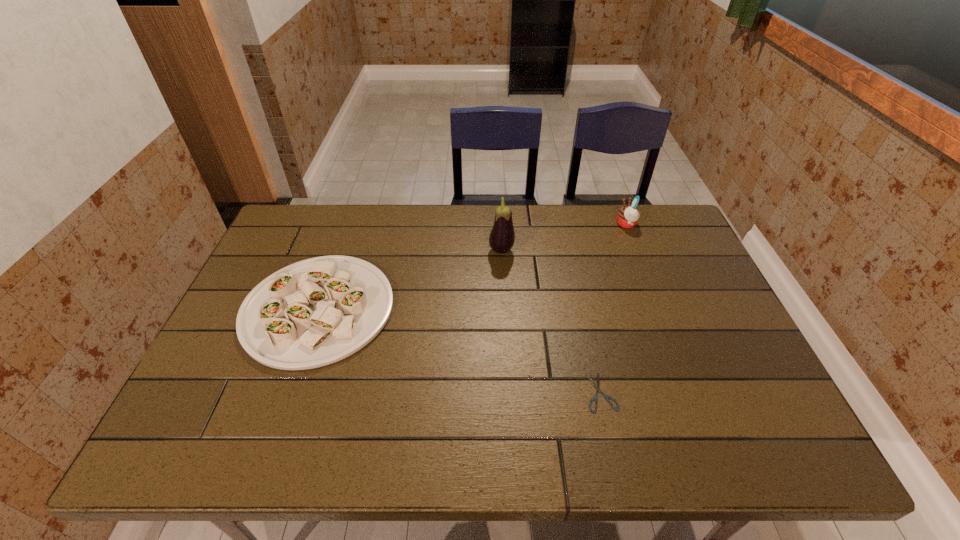
You are a GUI agent. You are given a task and a screenshot of the screen. Output one action in this format:
    pyautogui.click(x=<x>, y=<y>)
    Task: Click on the free space between the platter and the eggplant
    This screenshot has width=960, height=540.
    Given the screenshot: What is the action you would take?
    pyautogui.click(x=410, y=280)

Find the location of `free space between the second tallest object and the tallest object`. free space between the second tallest object and the tallest object is located at coordinates (564, 238).

This screenshot has width=960, height=540. I want to click on empty space that is in between the third tallest object and the shortest object, so click(460, 350).

This screenshot has width=960, height=540. In order to click on vacant space in between the eggplant and the leftmost object in this screenshot , I will do `click(410, 280)`.

I want to click on object that is the third closest to the tallest object, so click(607, 397).

Image resolution: width=960 pixels, height=540 pixels. In order to click on object that can be found as the closest to the leftmost object in this screenshot , I will do `click(502, 237)`.

Find the location of a particular element. The height and width of the screenshot is (540, 960). vacant region that satisfies the following two spatial constraints: 1. on the front-facing side of the third shortest object; 2. on the front side of the shears is located at coordinates (692, 392).

Locate an element on the screen. This screenshot has height=540, width=960. free spot that satisfies the following two spatial constraints: 1. on the front-facing side of the muffin; 2. on the front side of the tallest object is located at coordinates (637, 251).